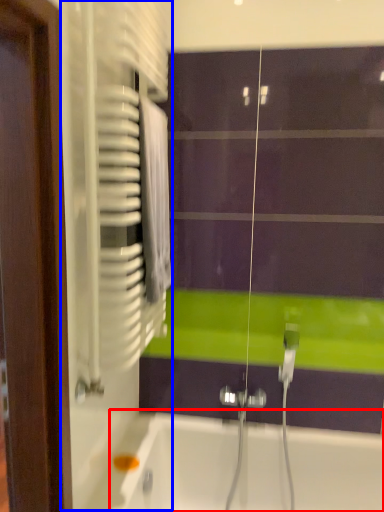
Question: Which object is closer to the camera taking this photo, bathtub (highlighted by a red box) or screen door (highlighted by a blue box)?

Choices:
 (A) bathtub
 (B) screen door

Answer: (B)